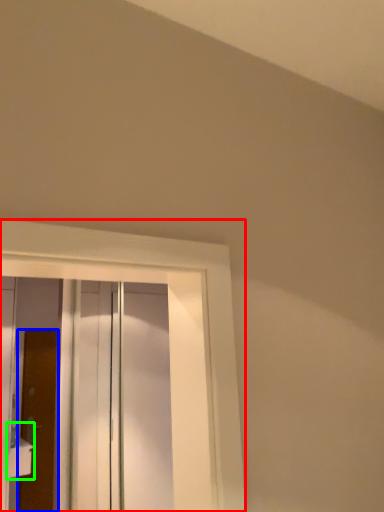
Question: Considering the real-world distances, which object is closest to window (highlighted by a red box)? door (highlighted by a blue box) or sink (highlighted by a green box).

Choices:
 (A) door
 (B) sink

Answer: (B)